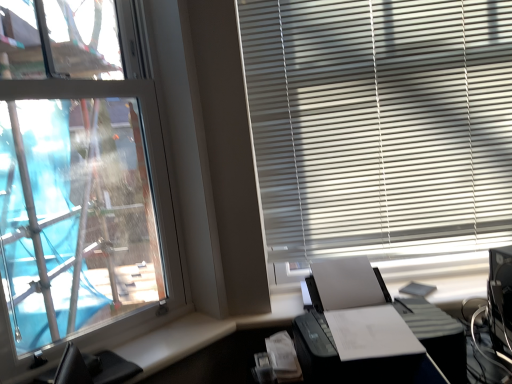
Question: Considering their positions, is transparent glass window at left located in front of or behind black plastic printer at lower right?

Choices:
 (A) front
 (B) behind

Answer: (A)

Question: Would you say transparent glass window at left is inside or outside black plastic printer at lower right?

Choices:
 (A) inside
 (B) outside

Answer: (B)

Question: Which object is the farthest from the transparent glass window at left?

Choices:
 (A) white matte blinds at upper right
 (B) black leather computer chair at lower left
 (C) black plastic printer at lower right

Answer: (C)

Question: Which of these objects is positioned closest to the white matte blinds at upper right?

Choices:
 (A) transparent glass window at left
 (B) black leather computer chair at lower left
 (C) black plastic printer at lower right

Answer: (C)